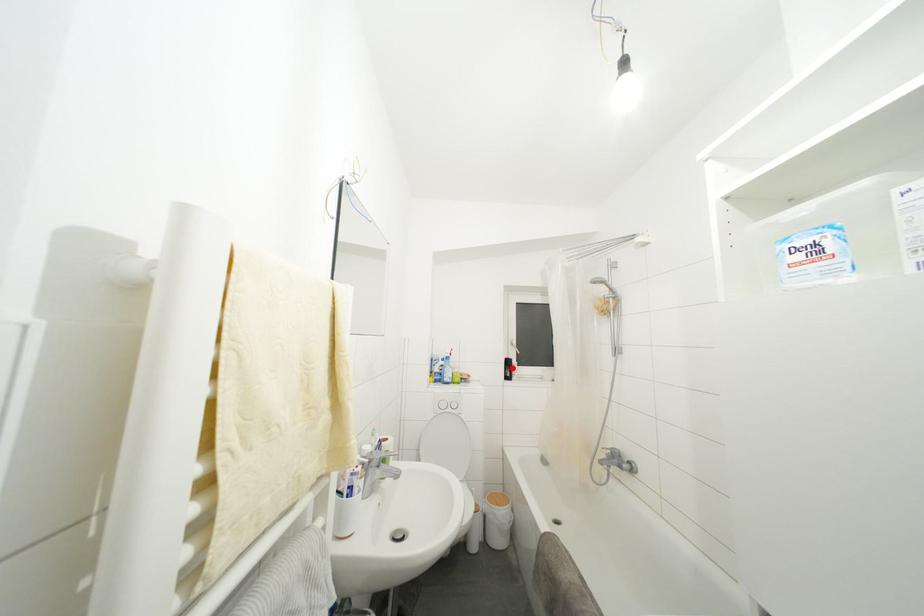
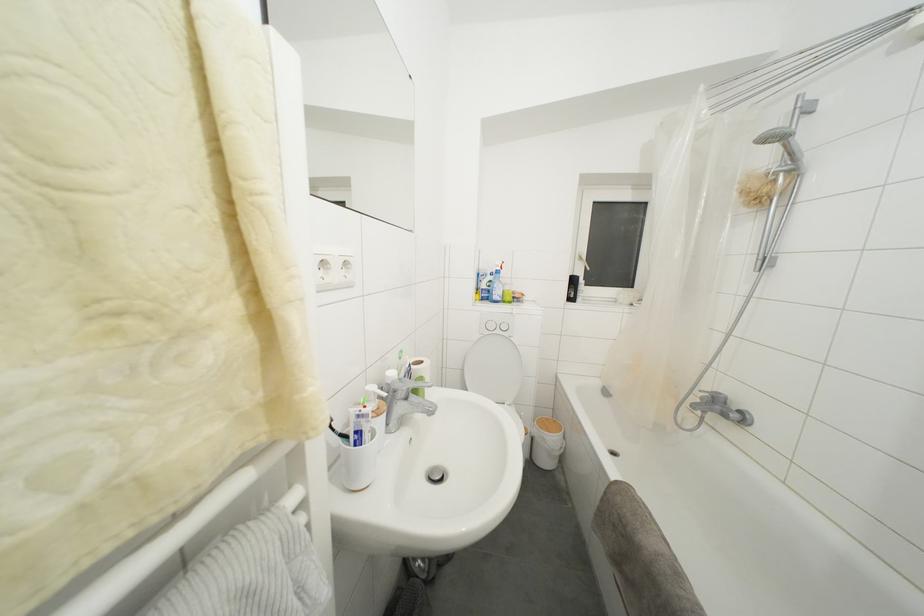
Find the pixel in the second image that matches the highlighted location in the first image.

(578, 286)